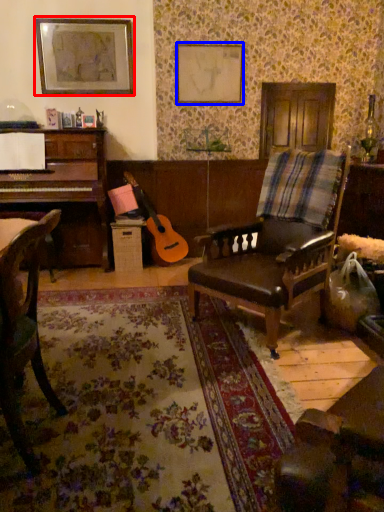
Question: Which object is further to the camera taking this photo, picture frame (highlighted by a red box) or picture frame (highlighted by a blue box)?

Choices:
 (A) picture frame
 (B) picture frame

Answer: (B)